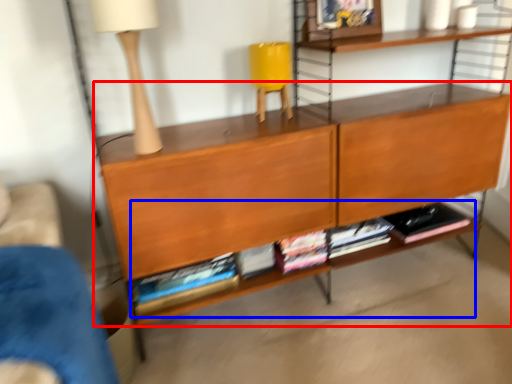
Question: Which point is further to the camera, shelf (highlighted by a red box) or book (highlighted by a blue box)?

Choices:
 (A) shelf
 (B) book

Answer: (B)